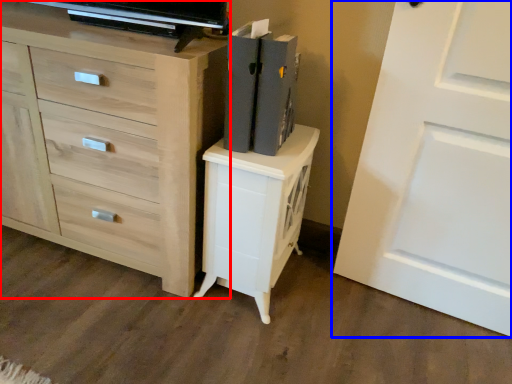
Question: Which of the following is the farthest to the observer, chest of drawers (highlighted by a red box) or door (highlighted by a blue box)?

Choices:
 (A) chest of drawers
 (B) door

Answer: (A)